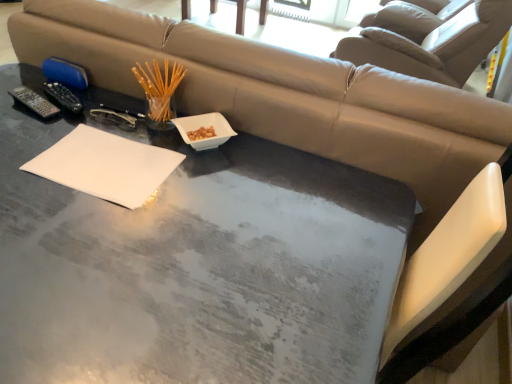
This screenshot has height=384, width=512. Find the location of `vacant space that is to the left of translucent glass chopsticks at upper left`. vacant space that is to the left of translucent glass chopsticks at upper left is located at coordinates (106, 113).